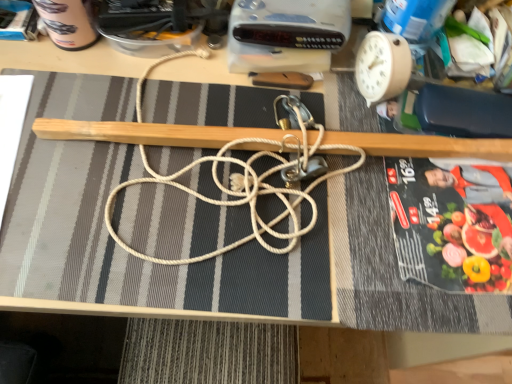
Question: Considering the relative sizes of beige plastic clock at upper right and black glossy paperback book at right, which is counted as the 2th paperback book, starting from the back, in the image provided, is beige plastic clock at upper right smaller than black glossy paperback book at right, which is counted as the 2th paperback book, starting from the back,?

Choices:
 (A) no
 (B) yes

Answer: (B)

Question: Is beige plastic clock at upper right positioned before black glossy paperback book at right, which is counted as the first paperback book, starting from the bottom?

Choices:
 (A) no
 (B) yes

Answer: (A)

Question: Does beige plastic clock at upper right touch black glossy paperback book at right, acting as the 2th paperback book starting from the left?

Choices:
 (A) yes
 (B) no

Answer: (B)

Question: Can black glossy paperback book at right, which is counted as the 2th paperback book, starting from the back, be found inside beige plastic clock at upper right?

Choices:
 (A) yes
 (B) no

Answer: (B)

Question: From a real-world perspective, is beige plastic clock at upper right beneath black glossy paperback book at right, which is counted as the first paperback book, starting from the bottom?

Choices:
 (A) no
 (B) yes

Answer: (A)

Question: From the image's perspective, would you say beige plastic clock at upper right is shown under black glossy paperback book at right, arranged as the 2th paperback book when viewed from the top?

Choices:
 (A) yes
 (B) no

Answer: (B)

Question: From a real-world perspective, is black glossy paperback book at right, which is counted as the 1th paperback book, starting from the right, located beneath beige plastic clock at upper right?

Choices:
 (A) yes
 (B) no

Answer: (A)

Question: Is black glossy paperback book at right, arranged as the 2th paperback book when viewed from the top, to the right of beige plastic clock at upper right from the viewer's perspective?

Choices:
 (A) yes
 (B) no

Answer: (A)

Question: Is black glossy paperback book at right, which is counted as the first paperback book, starting from the bottom, looking in the opposite direction of beige plastic clock at upper right?

Choices:
 (A) yes
 (B) no

Answer: (B)

Question: From the image's perspective, is black glossy paperback book at right, the 1th paperback book viewed from the front, located beneath beige plastic clock at upper right?

Choices:
 (A) yes
 (B) no

Answer: (A)

Question: Does black glossy paperback book at right, the 1th paperback book viewed from the front, lie behind beige plastic clock at upper right?

Choices:
 (A) no
 (B) yes

Answer: (A)

Question: Is black glossy paperback book at right, which is counted as the 2th paperback book, starting from the back, smaller than beige plastic clock at upper right?

Choices:
 (A) no
 (B) yes

Answer: (A)

Question: From a real-world perspective, is white rope at center located higher than beige plastic clock at upper right?

Choices:
 (A) yes
 (B) no

Answer: (B)